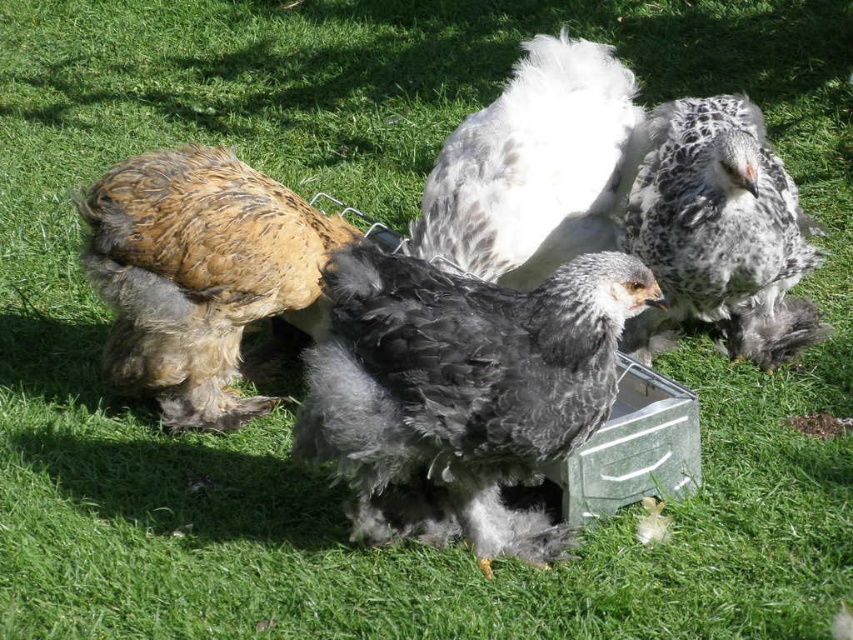
Who is positioned more to the left, brown fluffy chicken at left or white fluffy chicken at center?

brown fluffy chicken at left

Is point (157, 227) less distant than point (518, 138)?

Yes, point (157, 227) is in front of point (518, 138).

You are a GUI agent. You are given a task and a screenshot of the screen. Output one action in this format:
    pyautogui.click(x=<x>, y=<y>)
    Task: Click on the brown fluffy chicken at left
    
    Given the screenshot: What is the action you would take?
    pyautogui.click(x=198, y=275)

Could you measure the distance between silvery-gray fluffy chicken at center and speckled feathered chicken at center right?

silvery-gray fluffy chicken at center and speckled feathered chicken at center right are 98.38 centimeters apart from each other.

Does silvery-gray fluffy chicken at center have a greater width compared to speckled feathered chicken at center right?

Correct, the width of silvery-gray fluffy chicken at center exceeds that of speckled feathered chicken at center right.

Which is in front, point (498, 288) or point (728, 177)?

Positioned in front is point (498, 288).

Locate an element on the screen. silvery-gray fluffy chicken at center is located at coordinates (462, 385).

Is white fluffy chicken at center to the right of speckled feathered chicken at center right from the viewer's perspective?

No, white fluffy chicken at center is not to the right of speckled feathered chicken at center right.

The width and height of the screenshot is (853, 640). In order to click on white fluffy chicken at center in this screenshot , I will do `click(532, 166)`.

Measure the distance between point (489, 148) and camera.

A distance of 3.06 meters exists between point (489, 148) and camera.

Locate an element on the screen. This screenshot has width=853, height=640. white fluffy chicken at center is located at coordinates (532, 166).